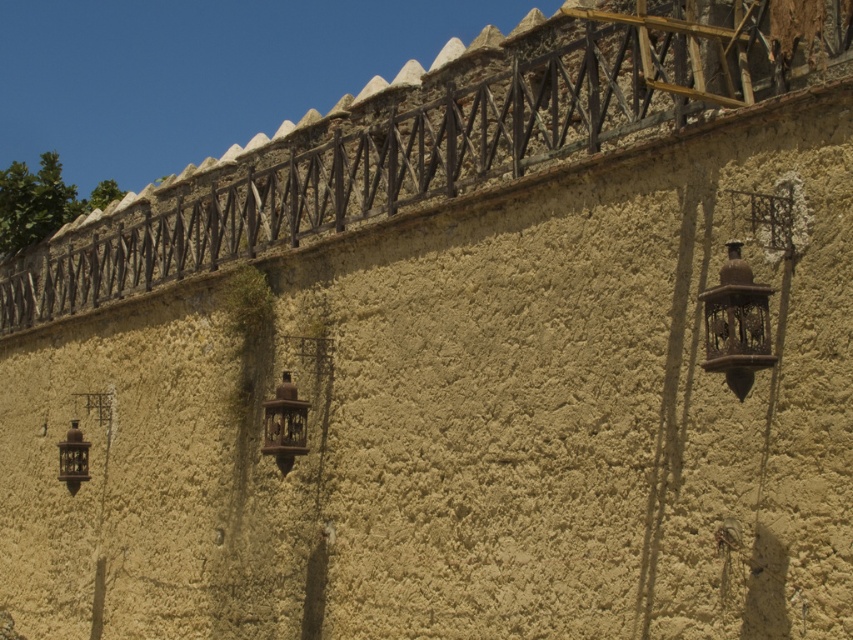
This screenshot has height=640, width=853. What do you see at coordinates (735, 323) in the screenshot? I see `antique brass lantern at right` at bounding box center [735, 323].

Which is more to the right, antique brass lantern at right or matte bronze lantern at lower left?

antique brass lantern at right is more to the right.

What do you see at coordinates (735, 323) in the screenshot?
I see `antique brass lantern at right` at bounding box center [735, 323].

The image size is (853, 640). Identify the location of antique brass lantern at right. (735, 323).

Between rusty metal lantern at center and matte bronze lantern at lower left, which one has more height?

rusty metal lantern at center is taller.

Where is `rusty metal lantern at center`? The width and height of the screenshot is (853, 640). rusty metal lantern at center is located at coordinates (285, 424).

Consider the image. Is antique brass lantern at right to the left of rusty metal lantern at center from the viewer's perspective?

Incorrect, antique brass lantern at right is not on the left side of rusty metal lantern at center.

In the scene shown: Which of these two, antique brass lantern at right or rusty metal lantern at center, stands shorter?

antique brass lantern at right

Find the location of a particular element. antique brass lantern at right is located at coordinates (735, 323).